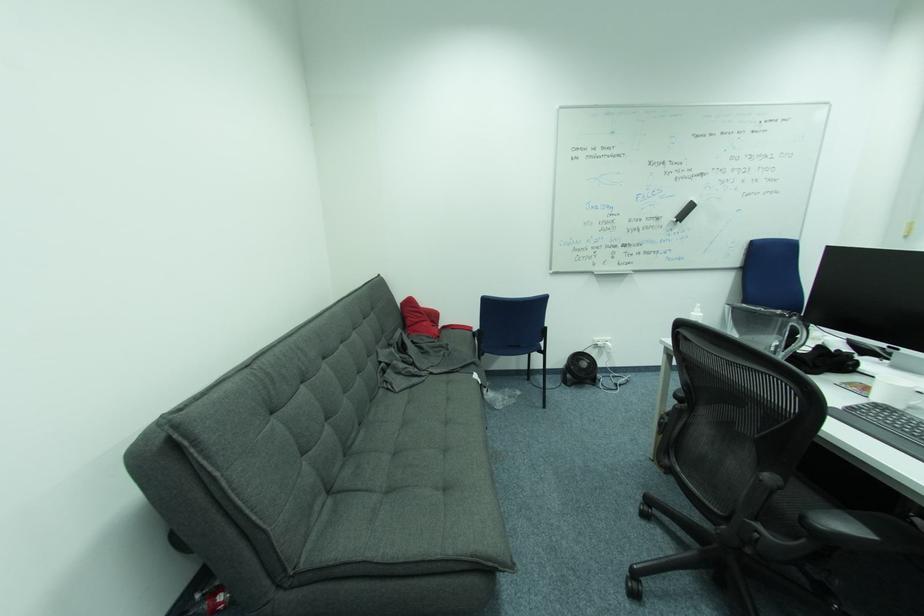
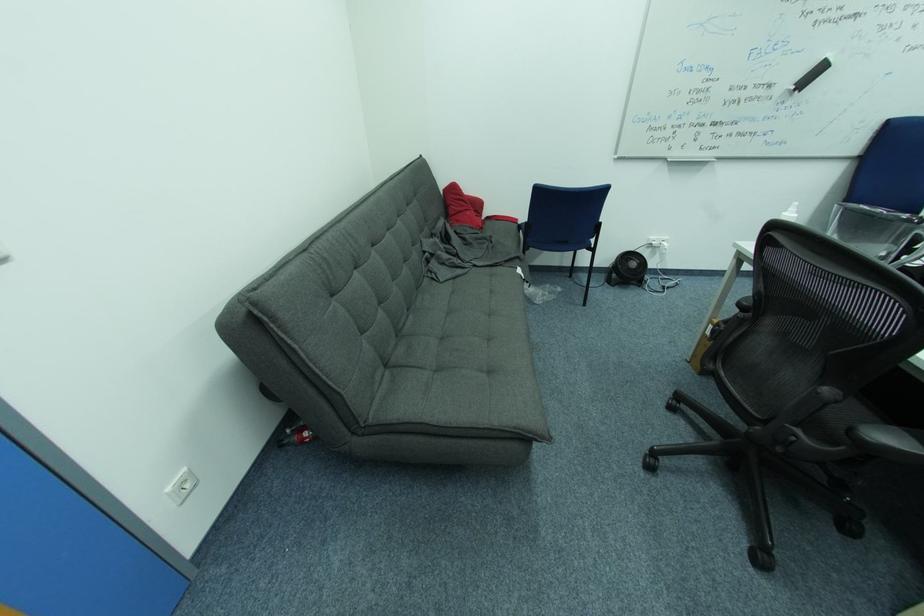
In the second image, find the point that corresponds to (569,386) in the first image.

(613, 285)